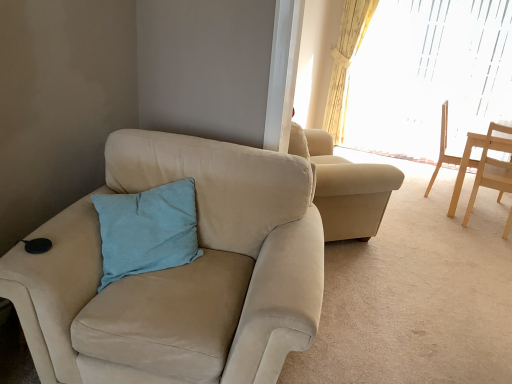
Where is `vacant region to the left of light brown wooden chair at right, placed as the second chair when sorted from left to right`? The height and width of the screenshot is (384, 512). vacant region to the left of light brown wooden chair at right, placed as the second chair when sorted from left to right is located at coordinates (415, 194).